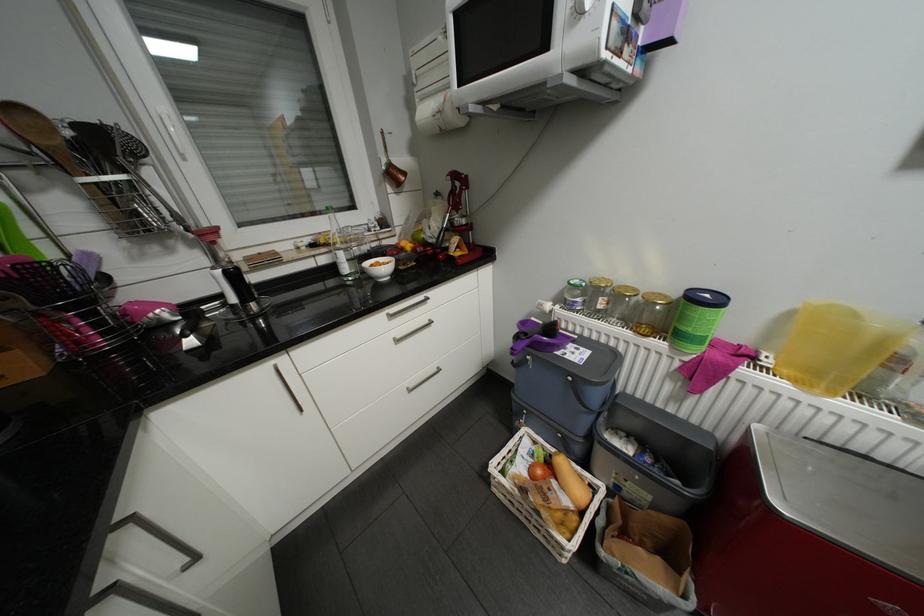
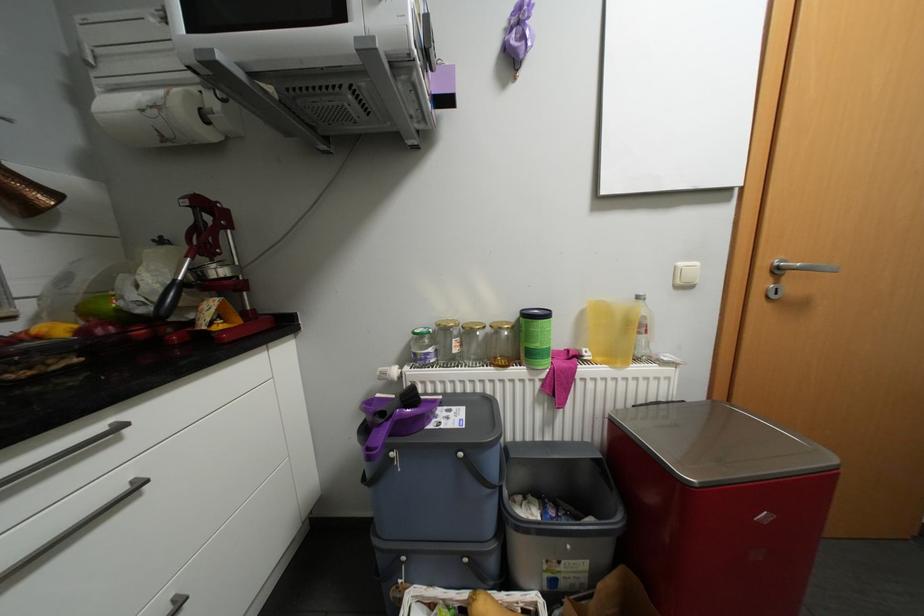
Question: The camera is either moving clockwise (left) or counter-clockwise (right) around the object. The first image is from the beginning of the video and the second image is from the end. Is the camera moving left or right when shooting the video?

Choices:
 (A) Left
 (B) Right

Answer: (A)